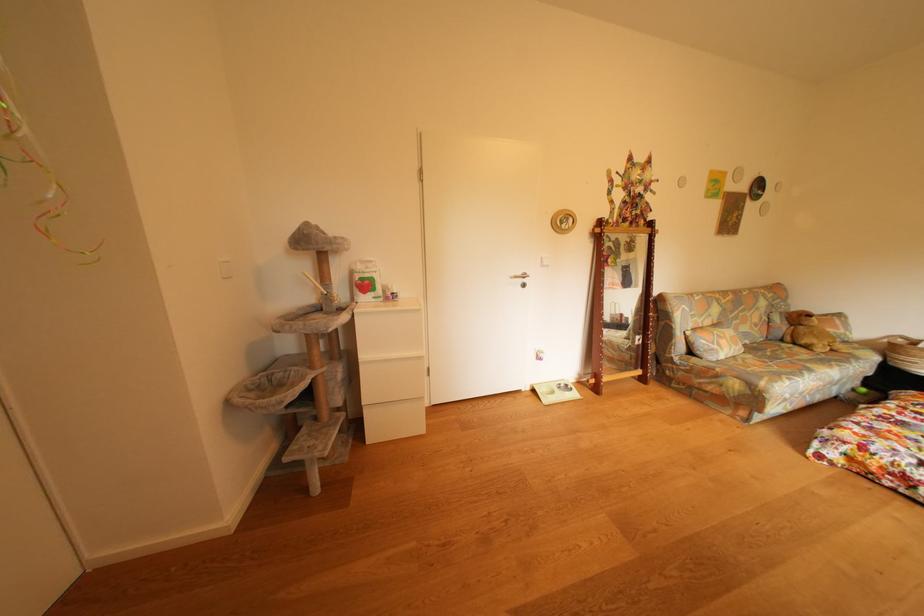
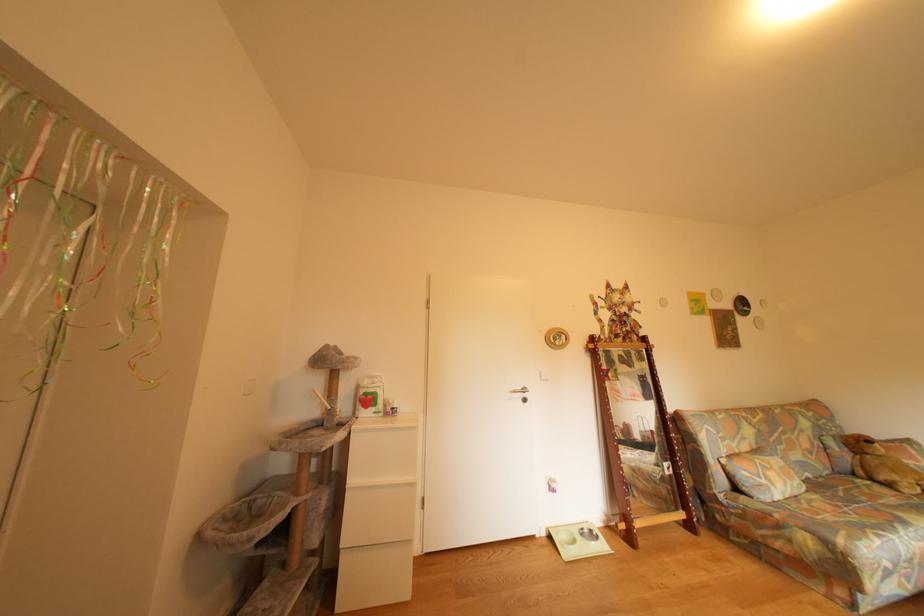
What movement of the cameraman would produce the second image?

The cameraman moved toward right, backward.